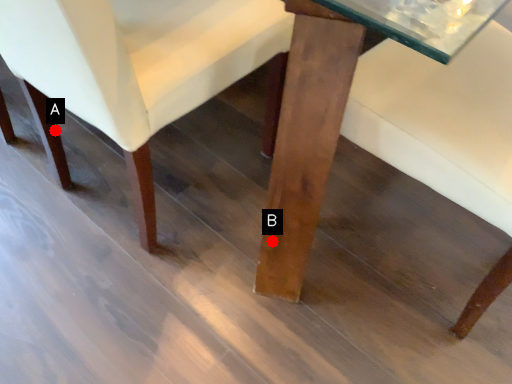
Question: Two points are circled on the image, labeled by A and B beside each circle. Which point appears closest to the camera in this image?

Choices:
 (A) A is closer
 (B) B is closer

Answer: (B)